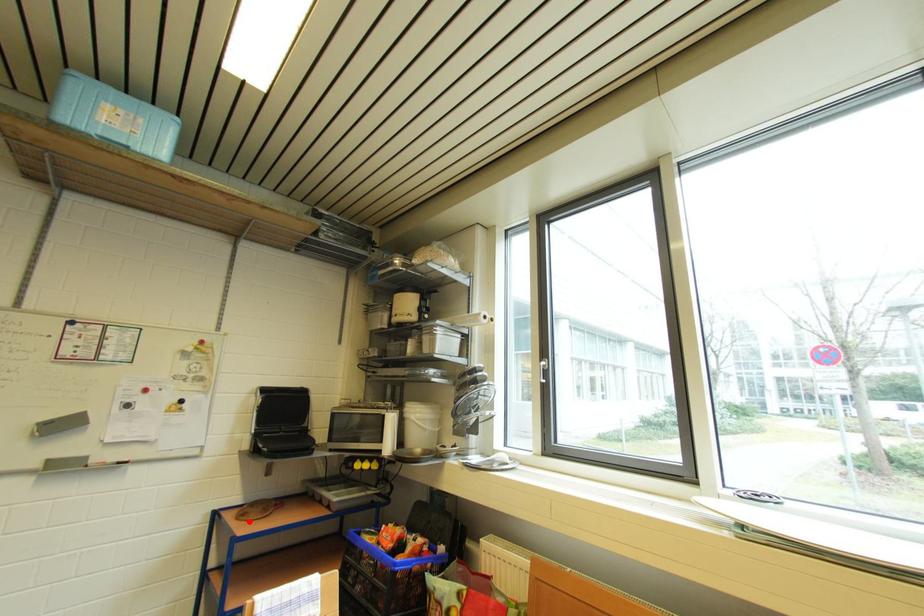
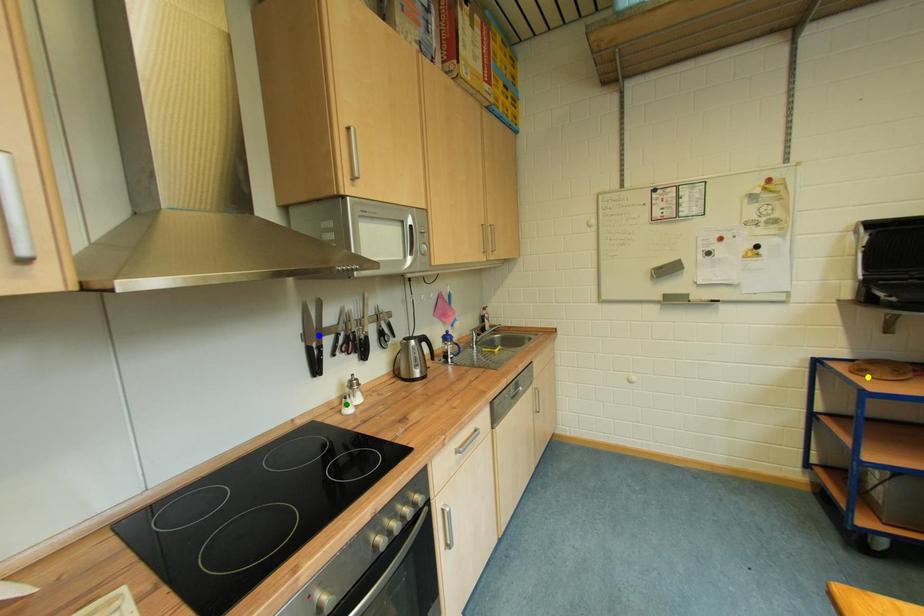
Question: I am providing you with two images of the same scene from different viewpoints. A red point is marked on the first image. You are given multiple points on the second image. In image 2, which mark is for the same physical point as the one in image 1?

Choices:
 (A) blue point
 (B) yellow point
 (C) green point

Answer: (B)